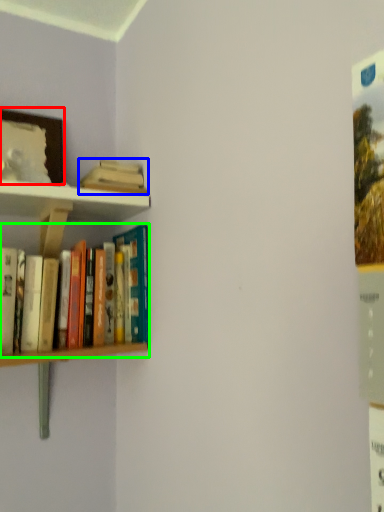
Question: Estimate the real-world distances between objects in this image. Which object is closer to picture frame (highlighted by a red box), book (highlighted by a blue box) or book (highlighted by a green box)?

Choices:
 (A) book
 (B) book

Answer: (A)